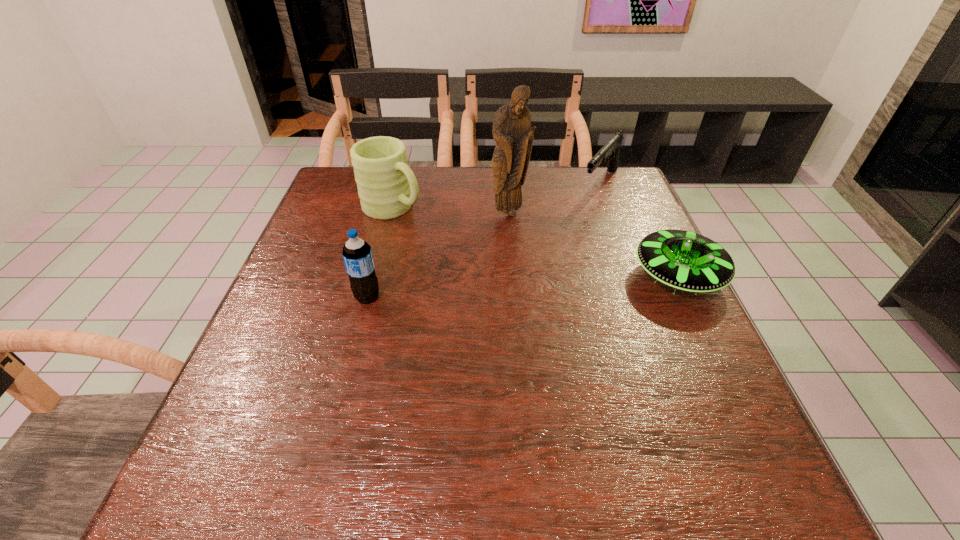
Find the location of `free space on the desktop that is between the soda bottle and the shortest object and is positioned on the front-facing side of the tallest object`. free space on the desktop that is between the soda bottle and the shortest object and is positioned on the front-facing side of the tallest object is located at coordinates (529, 287).

The height and width of the screenshot is (540, 960). What are the coordinates of `vacant space on the desktop that is between the soda bottle and the shortest object and is positioned at the aiming end of the gun` in the screenshot? It's located at (513, 288).

Locate an element on the screen. vacant spot on the desktop that is between the soda bottle and the shortest object and is positioned on the side of the mug with the handle is located at coordinates (533, 286).